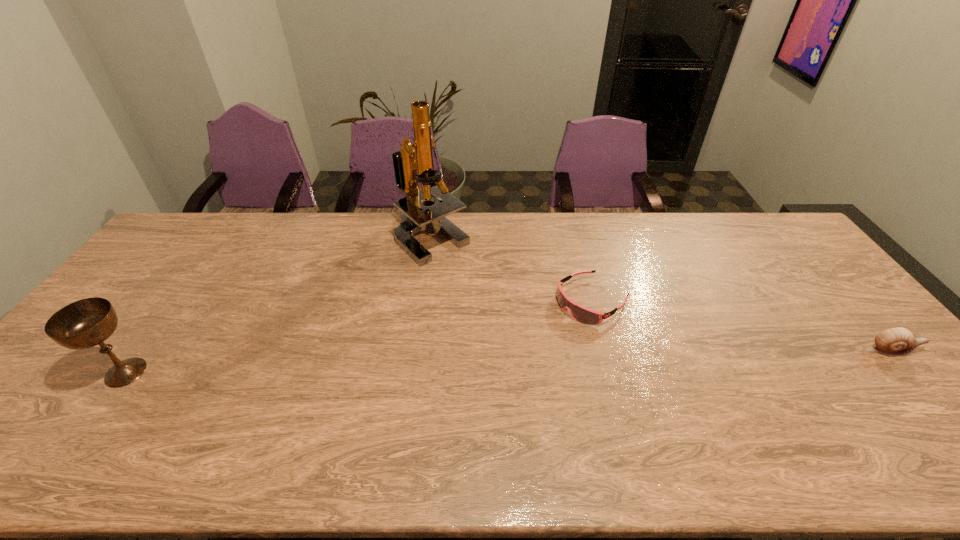
Where is `free space on the desktop that is between the third shortest object and the escargot and is positioned on the front-facing side of the shortest object`? This screenshot has width=960, height=540. free space on the desktop that is between the third shortest object and the escargot and is positioned on the front-facing side of the shortest object is located at coordinates (495, 362).

The image size is (960, 540). Find the location of `vacant space on the desktop that is between the leftmost object and the escargot and is positioned at the eyepiece of the tallest object`. vacant space on the desktop that is between the leftmost object and the escargot and is positioned at the eyepiece of the tallest object is located at coordinates (465, 363).